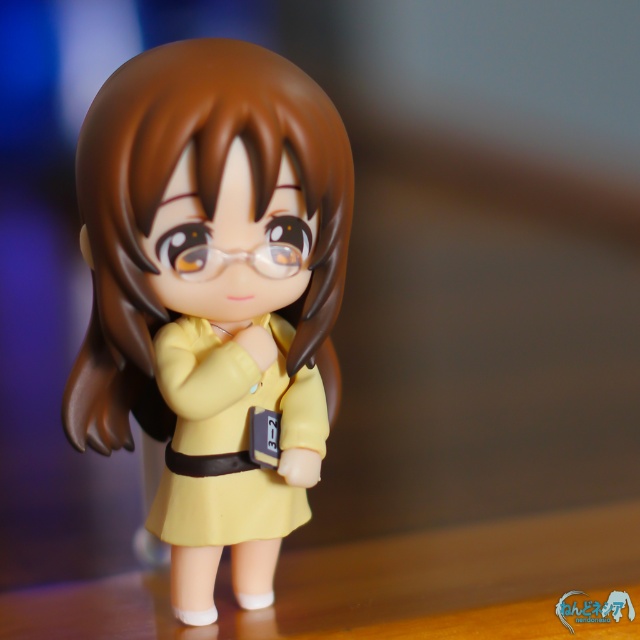
Does matte yellow dress at center have a lesser width compared to yellow matte dress at center?

Incorrect, matte yellow dress at center's width is not less than yellow matte dress at center's.

Does matte yellow dress at center have a lesser height compared to yellow matte dress at center?

In fact, matte yellow dress at center may be taller than yellow matte dress at center.

Image resolution: width=640 pixels, height=640 pixels. Find the location of `matte yellow dress at center`. matte yellow dress at center is located at coordinates (212, 292).

I want to click on matte yellow dress at center, so click(212, 292).